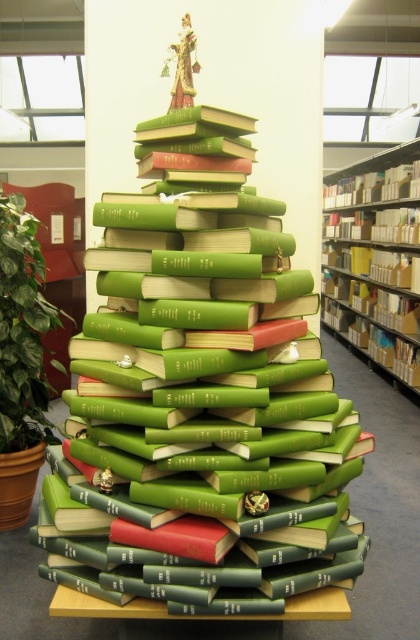
Question: Can you confirm if green matte books at center is smaller than green leafy plant at left?

Choices:
 (A) yes
 (B) no

Answer: (B)

Question: Where is yellow cardboard bookshelf at right located in relation to green leafy plant at left in the image?

Choices:
 (A) above
 (B) below

Answer: (A)

Question: Which object appears farthest from the camera in this image?

Choices:
 (A) green leafy plant at left
 (B) green matte books at center
 (C) yellow cardboard bookshelf at right

Answer: (C)

Question: Which of these objects is positioned closest to the yellow cardboard bookshelf at right?

Choices:
 (A) green leafy plant at left
 (B) green matte books at center

Answer: (B)

Question: Which object is the closest to the green matte books at center?

Choices:
 (A) green leafy plant at left
 (B) yellow cardboard bookshelf at right

Answer: (A)

Question: Is green matte books at center closer to the viewer compared to green leafy plant at left?

Choices:
 (A) no
 (B) yes

Answer: (B)